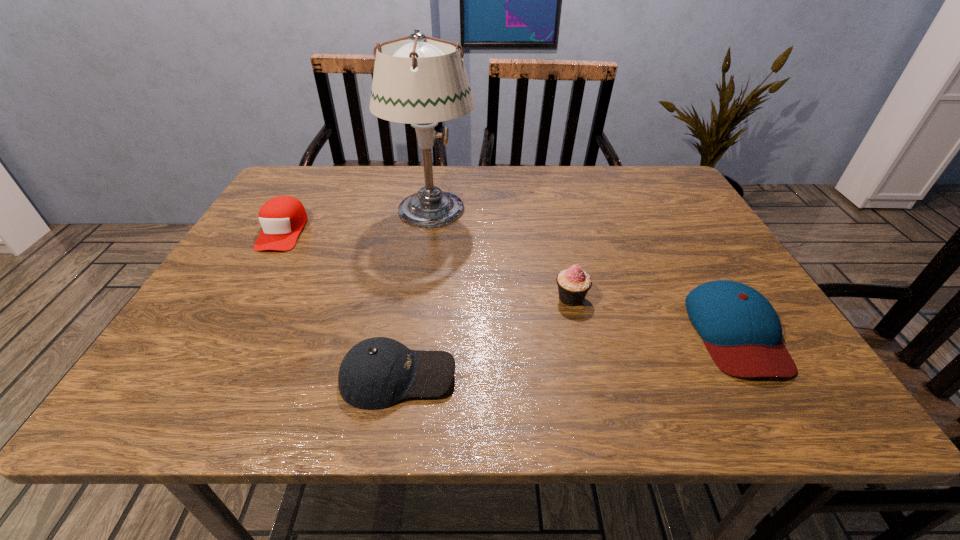
Image resolution: width=960 pixels, height=540 pixels. Find the location of `vacant space located on the front-facing side of the second baseball cap from right to left`. vacant space located on the front-facing side of the second baseball cap from right to left is located at coordinates (683, 376).

What are the coordinates of `object at the far edge` in the screenshot? It's located at (421, 82).

The image size is (960, 540). I want to click on object that is at the left edge, so click(282, 218).

In order to click on object that is at the right edge in this screenshot , I will do `click(741, 330)`.

Locate an element on the screen. Image resolution: width=960 pixels, height=540 pixels. object situated at the near right corner is located at coordinates (741, 330).

Image resolution: width=960 pixels, height=540 pixels. Identify the location of vacant space at the far edge. (550, 207).

In the image, there is a desktop. Where is `vacant space at the near edge`? The width and height of the screenshot is (960, 540). vacant space at the near edge is located at coordinates (273, 390).

Where is `vacant space at the right edge of the desktop`? The height and width of the screenshot is (540, 960). vacant space at the right edge of the desktop is located at coordinates (708, 279).

This screenshot has width=960, height=540. I want to click on free space at the near left corner of the desktop, so click(x=161, y=381).

In the image, there is a desktop. Where is `vacant space at the far right corner`? The height and width of the screenshot is (540, 960). vacant space at the far right corner is located at coordinates (664, 174).